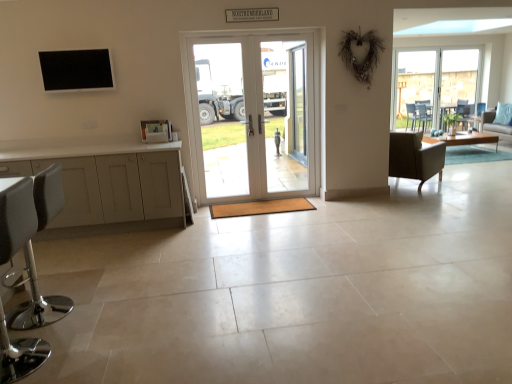
Locate an element on the screen. This screenshot has height=384, width=512. clear glass door at center, arranged as the second screen door when viewed from the right is located at coordinates (229, 116).

Measure the distance between point (125, 175) and camera.

Point (125, 175) and camera are 4.34 meters apart from each other.

The width and height of the screenshot is (512, 384). Identify the location of clear glass door at center, arranged as the second screen door when viewed from the right. 229,116.

Considering the positions of objects clear glass door at center, the first screen door positioned from the right, and light blue fabric couch at right in the image provided, who is more to the left, clear glass door at center, the first screen door positioned from the right, or light blue fabric couch at right?

Positioned to the left is clear glass door at center, the first screen door positioned from the right.

Does clear glass door at center, the first screen door positioned from the right, touch light blue fabric couch at right?

No.

Which point is more distant from viewer, (276, 62) or (504, 123)?

Point (504, 123)

In the image, is clear glass door at center, which appears as the 2th screen door when viewed from the left, positioned in front of or behind light blue fabric couch at right?

clear glass door at center, which appears as the 2th screen door when viewed from the left, is in front of light blue fabric couch at right.

How many degrees apart are the facing directions of black matte tv at upper left and clear glass door at center, the first screen door positioned from the right?

The angle between the facing direction of black matte tv at upper left and the facing direction of clear glass door at center, the first screen door positioned from the right, is 1.75 degrees.

Are black matte tv at upper left and clear glass door at center, the first screen door positioned from the right, located far from each other?

Yes, black matte tv at upper left is far from clear glass door at center, the first screen door positioned from the right.

Considering the sizes of objects black matte tv at upper left and clear glass door at center, which appears as the 2th screen door when viewed from the left, in the image provided, who is smaller, black matte tv at upper left or clear glass door at center, which appears as the 2th screen door when viewed from the left,?

Smaller between the two is black matte tv at upper left.

Measure the distance between black matte tv at upper left and clear glass door at center, the first screen door positioned from the right.

black matte tv at upper left is 7.04 feet from clear glass door at center, the first screen door positioned from the right.

Which of these two, light blue fabric couch at right or clear glass door at center, which appears as the 2th screen door when viewed from the left, is bigger?

With larger size is light blue fabric couch at right.

Which of these two, light blue fabric couch at right or clear glass door at center, which appears as the 2th screen door when viewed from the left, stands taller?

clear glass door at center, which appears as the 2th screen door when viewed from the left.

Does light blue fabric couch at right appear on the right side of clear glass door at center, which appears as the 2th screen door when viewed from the left?

Correct, you'll find light blue fabric couch at right to the right of clear glass door at center, which appears as the 2th screen door when viewed from the left.

Can we say light blue fabric couch at right lies outside clear glass door at center, which appears as the 2th screen door when viewed from the left?

That's correct, light blue fabric couch at right is outside of clear glass door at center, which appears as the 2th screen door when viewed from the left.

Consider the image. How different are the orientations of clear glass door at center, which appears as the 2th screen door when viewed from the left, and light brown wooden coffee table at right in degrees?

clear glass door at center, which appears as the 2th screen door when viewed from the left, and light brown wooden coffee table at right are facing 0.235 degrees away from each other.

From the image's perspective, which is below, clear glass door at center, the first screen door positioned from the right, or light brown wooden coffee table at right?

clear glass door at center, the first screen door positioned from the right.

Considering the positions of point (261, 144) and point (463, 140), is point (261, 144) closer or farther from the camera than point (463, 140)?

Point (261, 144) is positioned closer to the camera compared to point (463, 140).

Which is in front, clear glass door at center, which appears as the 2th screen door when viewed from the left, or light brown wooden coffee table at right?

clear glass door at center, which appears as the 2th screen door when viewed from the left.

How different are the orientations of light brown wooden coffee table at right and white glossy door at center in degrees?

They differ by 0.235 degrees in their facing directions.

From a real-world perspective, between light brown wooden coffee table at right and white glossy door at center, who is vertically lower?

In real-world perspective, light brown wooden coffee table at right is lower.

Considering the sizes of light brown wooden coffee table at right and white glossy door at center in the image, is light brown wooden coffee table at right bigger or smaller than white glossy door at center?

→ In the image, light brown wooden coffee table at right appears to be larger than white glossy door at center.

Considering the sizes of objects light blue fabric couch at right and light brown wooden coffee table at right in the image provided, who is thinner, light blue fabric couch at right or light brown wooden coffee table at right?

Thinner between the two is light brown wooden coffee table at right.

The width and height of the screenshot is (512, 384). What are the coordinates of `couch above the light brown wooden coffee table at right (from a real-world perspective)` in the screenshot? It's located at [498, 121].

Is light blue fabric couch at right at the right side of light brown wooden coffee table at right?

Yes.

Does light blue fabric couch at right contain light brown wooden coffee table at right?

That's incorrect, light brown wooden coffee table at right is not inside light blue fabric couch at right.

From a real-world perspective, is white leather stool at lower left, placed as the 1th chair when sorted from front to back, under dark brown leather chair at right, which appears as the second chair when viewed from the left?

Actually, white leather stool at lower left, placed as the 1th chair when sorted from front to back, is physically above dark brown leather chair at right, which appears as the second chair when viewed from the left, in the real world.

Is white leather stool at lower left, the second chair in the right-to-left sequence, at the left side of dark brown leather chair at right, arranged as the first chair when viewed from the top?

Correct, you'll find white leather stool at lower left, the second chair in the right-to-left sequence, to the left of dark brown leather chair at right, arranged as the first chair when viewed from the top.

Considering the relative positions of white leather stool at lower left, the second chair in the right-to-left sequence, and dark brown leather chair at right, arranged as the first chair when viewed from the top, in the image provided, is white leather stool at lower left, the second chair in the right-to-left sequence, behind dark brown leather chair at right, arranged as the first chair when viewed from the top,?

No, it is in front of dark brown leather chair at right, arranged as the first chair when viewed from the top.

Between point (52, 170) and point (395, 172), which one is positioned in front?

The point (52, 170) is closer to the camera.

Locate an element on the screen. couch to the right of clear glass door at center, which appears as the 2th screen door when viewed from the left is located at coordinates (498, 121).

Where is `window in front of the clear glass door at center, which appears as the 2th screen door when viewed from the left`? The width and height of the screenshot is (512, 384). window in front of the clear glass door at center, which appears as the 2th screen door when viewed from the left is located at coordinates (76, 70).

Which object lies further to the anchor point black matte tv at upper left, matte gray cabinet at left or light brown wooden coffee table at right?

The object further to black matte tv at upper left is light brown wooden coffee table at right.

Considering their positions, is clear glass door at center, placed as the 1th screen door when sorted from left to right, positioned further to light blue fabric couch at right than white glossy door at center?

The object further to light blue fabric couch at right is clear glass door at center, placed as the 1th screen door when sorted from left to right.

Estimate the real-world distances between objects in this image. Which object is closer to clear glass door at center, the first screen door positioned from the right, black matte tv at upper left or light blue fabric couch at right?

black matte tv at upper left is closer to clear glass door at center, the first screen door positioned from the right.

From the image, which object appears to be nearer to clear glass door at center, arranged as the second screen door when viewed from the right, light brown wooden coffee table at right or dark brown leather chair at right, which is counted as the second chair, starting from the front?

Based on the image, dark brown leather chair at right, which is counted as the second chair, starting from the front, appears to be nearer to clear glass door at center, arranged as the second screen door when viewed from the right.

Based on the photo, when comparing their distances from white leather stool at lower left, which is counted as the second chair, starting from the back, does black matte tv at upper left or white glossy door at center seem closer?

black matte tv at upper left is positioned closer to the anchor white leather stool at lower left, which is counted as the second chair, starting from the back.

Estimate the real-world distances between objects in this image. Which object is closer to light brown wooden coffee table at right, light blue fabric couch at right or matte gray cabinet at left?

Among the two, light blue fabric couch at right is located nearer to light brown wooden coffee table at right.

Looking at the image, which one is located further to black matte tv at upper left, clear glass door at center, the first screen door positioned from the right, or white leather stool at lower left, arranged as the 2th chair when viewed from the top?

white leather stool at lower left, arranged as the 2th chair when viewed from the top, is further to black matte tv at upper left.

When comparing their distances from dark brown leather chair at right, which is counted as the second chair, starting from the front, does matte gray cabinet at left or black matte tv at upper left seem closer?

matte gray cabinet at left.

Image resolution: width=512 pixels, height=384 pixels. Identify the location of door positioned between white leather stool at lower left, arranged as the 2th chair when viewed from the top, and clear glass door at center, which appears as the 2th screen door when viewed from the left, from near to far. tap(255, 116).

The width and height of the screenshot is (512, 384). Identify the location of chair located between clear glass door at center, which appears as the 2th screen door when viewed from the left, and light blue fabric couch at right in the left-right direction. (415, 157).

Identify the location of door between clear glass door at center, placed as the 1th screen door when sorted from left to right, and light blue fabric couch at right from left to right. (255, 116).

At what (x,y) coordinates should I click in order to perform the action: click on table between clear glass door at center, arranged as the second screen door when viewed from the right, and light blue fabric couch at right from left to right. Please return your answer as a coordinate pair (x, y). The width and height of the screenshot is (512, 384). Looking at the image, I should click on (465, 139).